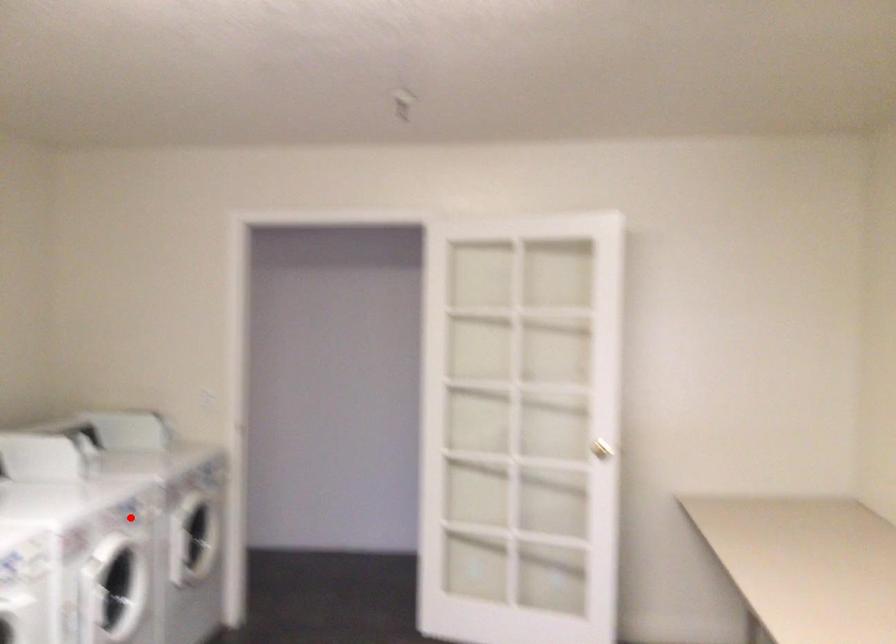
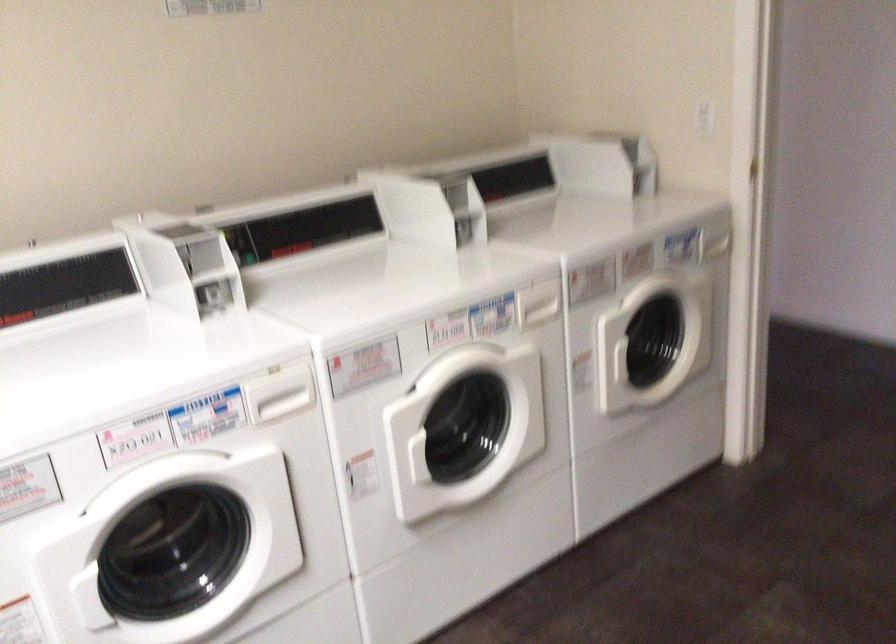
Question: I am providing you with two images of the same scene from different viewpoints. Image1 has a red point marked. In image2, the corresponding 3D location appears at what relative position? Reply with the corresponding letter.

Choices:
 (A) Closer
 (B) Farther

Answer: (A)